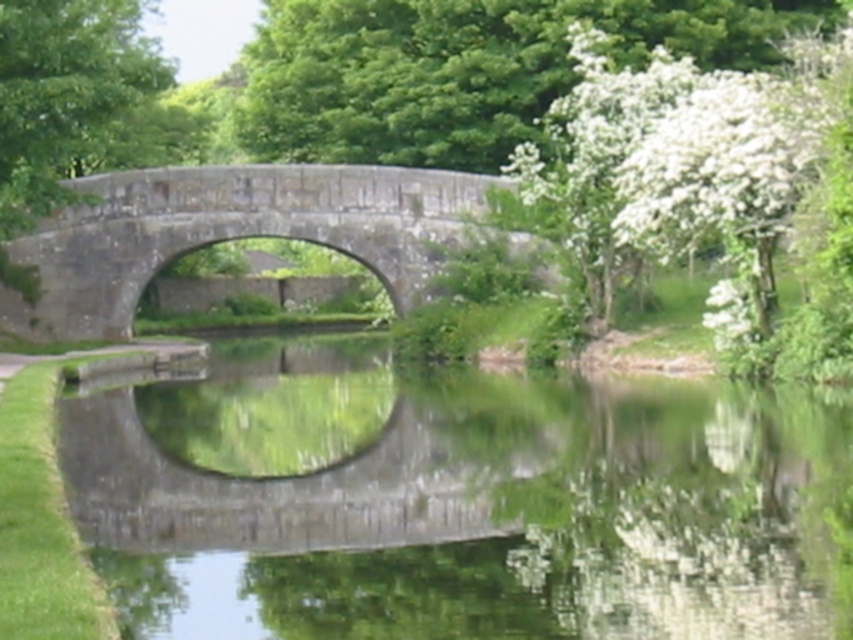
Question: Which object is farther from the camera taking this photo?

Choices:
 (A) green leafy tree at upper center
 (B) stone bridge at center

Answer: (A)

Question: Is green reflective water at center above stone bridge at center?

Choices:
 (A) no
 (B) yes

Answer: (A)

Question: Is green leafy tree at upper center positioned before stone bridge at center?

Choices:
 (A) no
 (B) yes

Answer: (A)

Question: Which point is farther to the camera?

Choices:
 (A) (65, 301)
 (B) (218, 560)

Answer: (A)

Question: Does green reflective water at center appear under stone bridge at center?

Choices:
 (A) yes
 (B) no

Answer: (A)

Question: Considering the real-world distances, which object is farthest from the green reflective water at center?

Choices:
 (A) green leafy tree at upper center
 (B) stone bridge at center

Answer: (A)